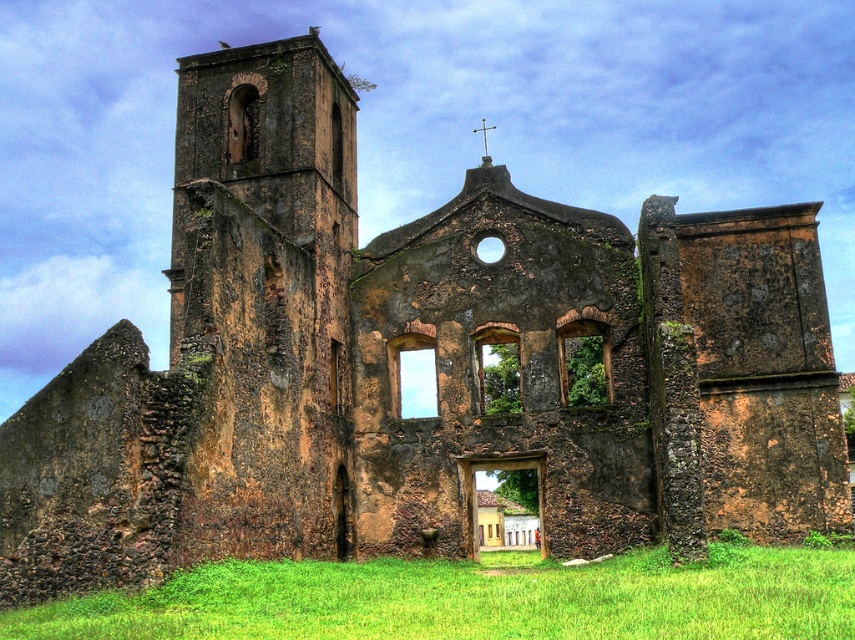
In the scene shown: Can you confirm if rusty stone tower at left is bigger than green grass at lower center?

Yes.

Is rusty stone tower at left positioned behind green grass at lower center?

Yes.

What do you see at coordinates (264, 298) in the screenshot? Image resolution: width=855 pixels, height=640 pixels. I see `rusty stone tower at left` at bounding box center [264, 298].

Image resolution: width=855 pixels, height=640 pixels. I want to click on rusty stone tower at left, so click(x=264, y=298).